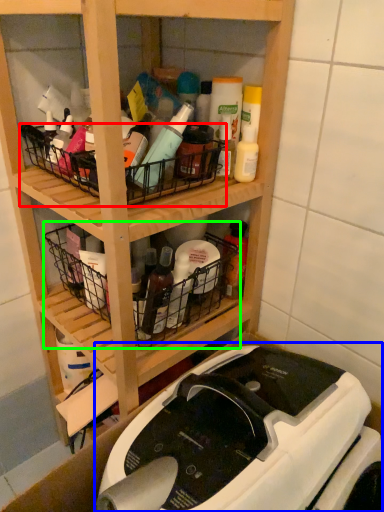
Question: Estimate the real-world distances between objects in this image. Which object is farther from basket (highlighted by a red box), sewing machine (highlighted by a blue box) or basket (highlighted by a green box)?

Choices:
 (A) sewing machine
 (B) basket

Answer: (A)